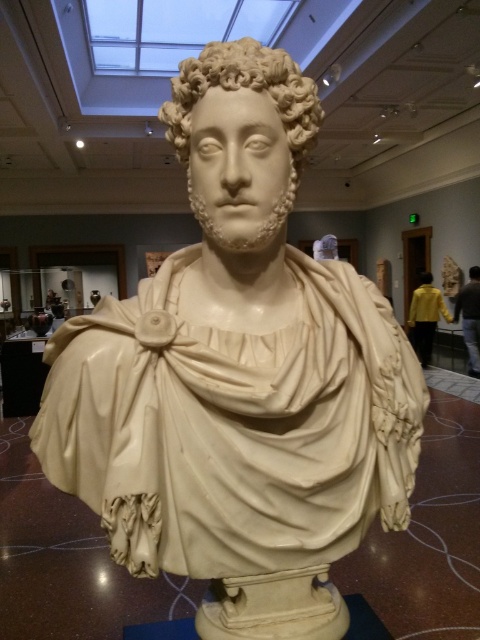
From the picture: Can you confirm if white marble bust at center is thinner than ivory sculpture at center?

In fact, white marble bust at center might be wider than ivory sculpture at center.

How distant is white marble bust at center from ivory sculpture at center?

white marble bust at center is 27.67 feet from ivory sculpture at center.

This screenshot has width=480, height=640. Identify the location of white marble bust at center. (253, 90).

Locate an element on the screen. This screenshot has width=480, height=640. white marble bust at center is located at coordinates (253, 90).